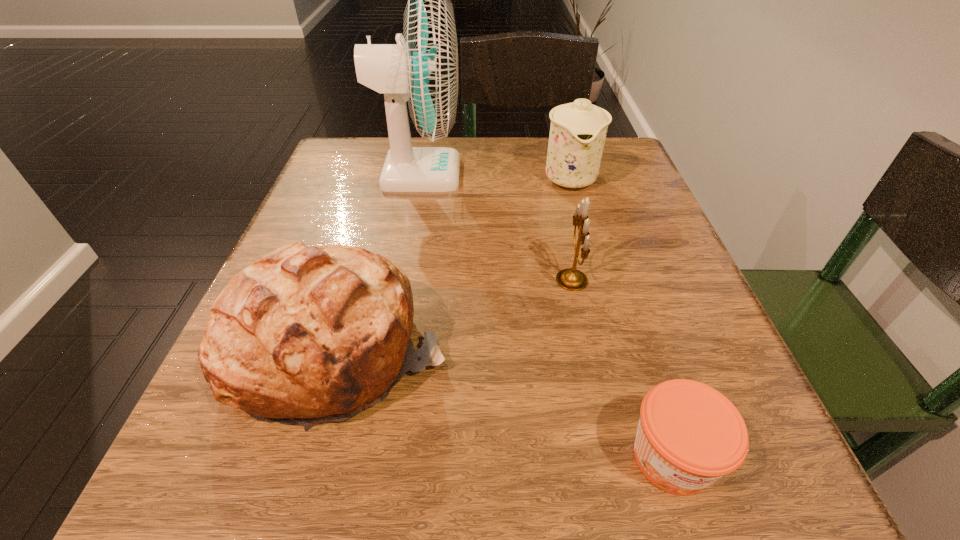
Identify the location of vacant point located between the candelabrum and the chinaware. 571,229.

Where is `vacant area between the chinaware and the tallest object`? vacant area between the chinaware and the tallest object is located at coordinates (494, 176).

The image size is (960, 540). In order to click on blank region between the bread and the candelabrum in this screenshot , I will do `click(455, 314)`.

At what (x,y) coordinates should I click in order to perform the action: click on object that can be found as the second closest to the candelabrum. Please return your answer as a coordinate pair (x, y). Image resolution: width=960 pixels, height=540 pixels. Looking at the image, I should click on (578, 130).

Where is `object that stands as the second closest to the bread`? The image size is (960, 540). object that stands as the second closest to the bread is located at coordinates (423, 70).

This screenshot has width=960, height=540. Find the location of `vacant region that satisfies the following two spatial constraints: 1. in front of the candelabrum to face the airflow; 2. on the right side of the fan`. vacant region that satisfies the following two spatial constraints: 1. in front of the candelabrum to face the airflow; 2. on the right side of the fan is located at coordinates (399, 280).

Find the location of a particular element. The image size is (960, 540). vacant space that satisfies the following two spatial constraints: 1. in front of the fan to face the airflow; 2. on the front side of the bread is located at coordinates (387, 348).

Find the location of a particular element. This screenshot has width=960, height=540. vacant area that satisfies the following two spatial constraints: 1. in front of the tallest object to face the airflow; 2. on the back side of the candelabrum is located at coordinates (399, 280).